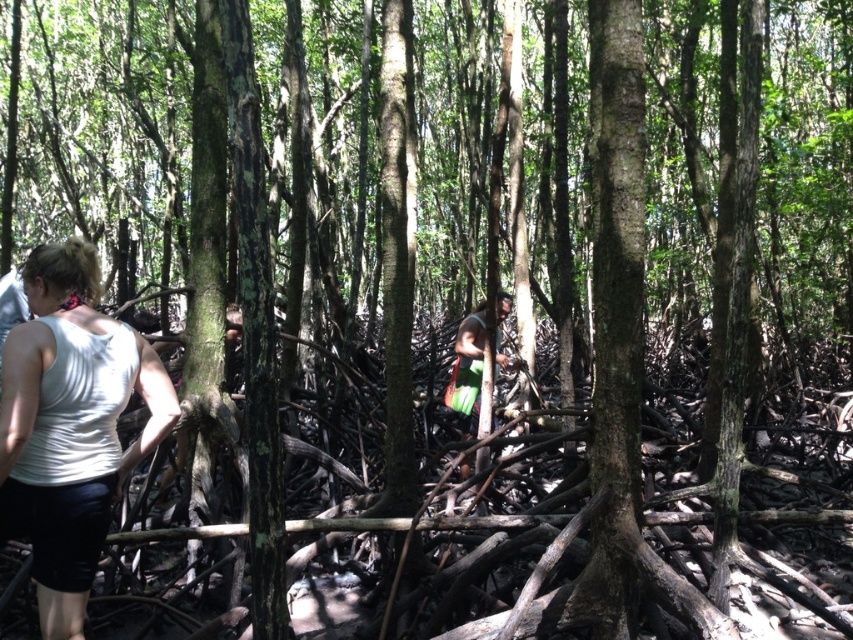
You are hiking in a dense forest and see a white fabric at left and a green fabric bag at center. Which item is smaller in size?

The white fabric at left is smaller in size compared to the green fabric bag at center.